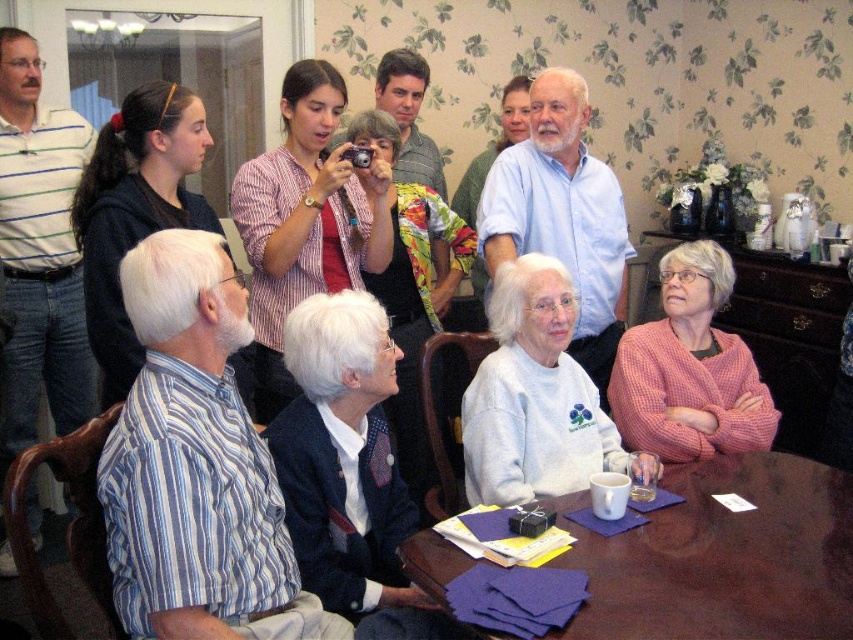
Can you confirm if pink waffle knit sweater at lower right is positioned below black hoodie at upper left?

Indeed, pink waffle knit sweater at lower right is positioned under black hoodie at upper left.

Measure the distance between pink waffle knit sweater at lower right and camera.

The distance of pink waffle knit sweater at lower right from camera is 2.27 meters.

Identify the location of pink waffle knit sweater at lower right. (689, 369).

Between striped shirt at upper center and floral fabric jacket at center, which one is positioned higher?

Positioned higher is striped shirt at upper center.

Does striped shirt at upper center have a greater width compared to floral fabric jacket at center?

Yes.

Is point (281, 220) closer to viewer compared to point (409, 412)?

Yes, point (281, 220) is closer to viewer.

Where is `striped shirt at upper center`? The height and width of the screenshot is (640, 853). striped shirt at upper center is located at coordinates (305, 221).

The height and width of the screenshot is (640, 853). What do you see at coordinates (722, 556) in the screenshot?
I see `brown wooden table at lower center` at bounding box center [722, 556].

Describe the element at coordinates (722, 556) in the screenshot. This screenshot has height=640, width=853. I see `brown wooden table at lower center` at that location.

Find the location of a particular element. The width and height of the screenshot is (853, 640). brown wooden table at lower center is located at coordinates pos(722,556).